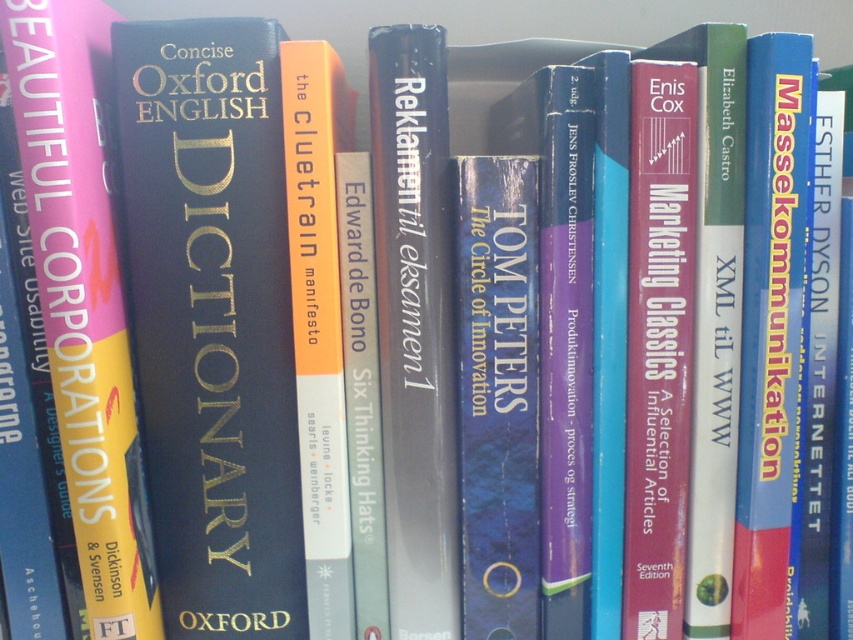
Question: In this image, where is matte black dictionary at center located relative to yellow matte hardcover book at left?

Choices:
 (A) left
 (B) right

Answer: (B)

Question: Can you confirm if yellow matte hardcover book at left is wider than hardcover book at center?

Choices:
 (A) yes
 (B) no

Answer: (A)

Question: Which is nearer to the matte black dictionary at center?

Choices:
 (A) hardcover book at center
 (B) yellow matte hardcover book at left

Answer: (B)

Question: Which object is farther from the camera taking this photo?

Choices:
 (A) matte black dictionary at center
 (B) hardcover book at center
 (C) yellow matte hardcover book at left

Answer: (A)

Question: Does matte black dictionary at center appear under yellow matte hardcover book at left?

Choices:
 (A) no
 (B) yes

Answer: (B)

Question: Which object appears closest to the camera in this image?

Choices:
 (A) yellow matte hardcover book at left
 (B) matte black dictionary at center

Answer: (A)